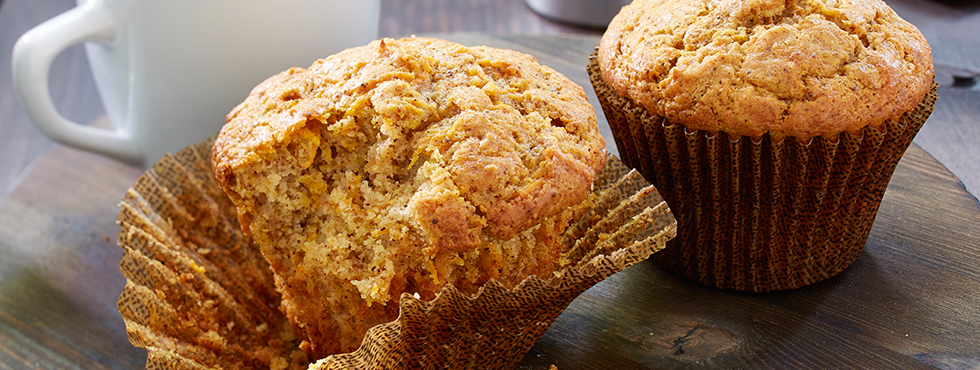
Locate an element on the screen. mugs is located at coordinates (575, 8), (189, 38).